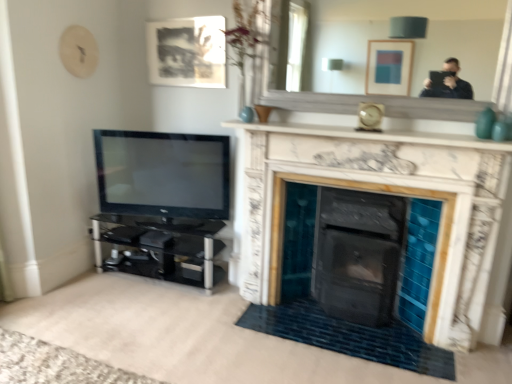
Question: Is white marble fireplace at upper center with matte black picture frame at upper center?

Choices:
 (A) no
 (B) yes

Answer: (A)

Question: Considering the relative sizes of white marble fireplace at upper center and matte black picture frame at upper center in the image provided, is white marble fireplace at upper center bigger than matte black picture frame at upper center?

Choices:
 (A) yes
 (B) no

Answer: (A)

Question: Does white marble fireplace at upper center lie in front of matte black picture frame at upper center?

Choices:
 (A) no
 (B) yes

Answer: (B)

Question: From a real-world perspective, does white marble fireplace at upper center sit lower than matte black picture frame at upper center?

Choices:
 (A) no
 (B) yes

Answer: (B)

Question: Does white marble fireplace at upper center have a lesser height compared to matte black picture frame at upper center?

Choices:
 (A) yes
 (B) no

Answer: (A)

Question: From a real-world perspective, is matte black picture frame at upper center above or below white marble fireplace at center?

Choices:
 (A) above
 (B) below

Answer: (A)

Question: Is point (221, 36) positioned closer to the camera than point (360, 185)?

Choices:
 (A) farther
 (B) closer

Answer: (A)

Question: Is matte black picture frame at upper center bigger or smaller than white marble fireplace at center?

Choices:
 (A) small
 (B) big

Answer: (A)

Question: Relative to white marble fireplace at center, is matte black picture frame at upper center in front or behind?

Choices:
 (A) behind
 (B) front

Answer: (A)

Question: From a real-world perspective, is black glossy tv at left positioned above or below matte black picture frame at upper center?

Choices:
 (A) below
 (B) above

Answer: (A)

Question: Is black glossy tv at left bigger or smaller than matte black picture frame at upper center?

Choices:
 (A) big
 (B) small

Answer: (A)

Question: In the image, is black glossy tv at left on the left side or the right side of matte black picture frame at upper center?

Choices:
 (A) left
 (B) right

Answer: (A)

Question: Is black glossy tv at left taller or shorter than matte black picture frame at upper center?

Choices:
 (A) short
 (B) tall

Answer: (B)

Question: Looking at their shapes, would you say matte black picture frame at upper center is wider or thinner than black glass entertainment center at left?

Choices:
 (A) thin
 (B) wide

Answer: (A)

Question: From a real-world perspective, relative to black glass entertainment center at left, is matte black picture frame at upper center vertically above or below?

Choices:
 (A) below
 (B) above

Answer: (B)